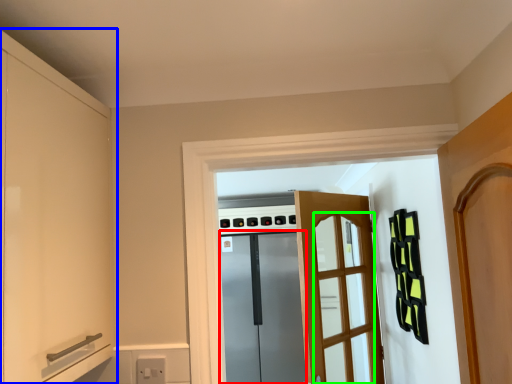
Question: Which is farther away from screen door (highlighted by a red box)? cabinetry (highlighted by a blue box) or screen door (highlighted by a green box)?

Choices:
 (A) cabinetry
 (B) screen door

Answer: (A)